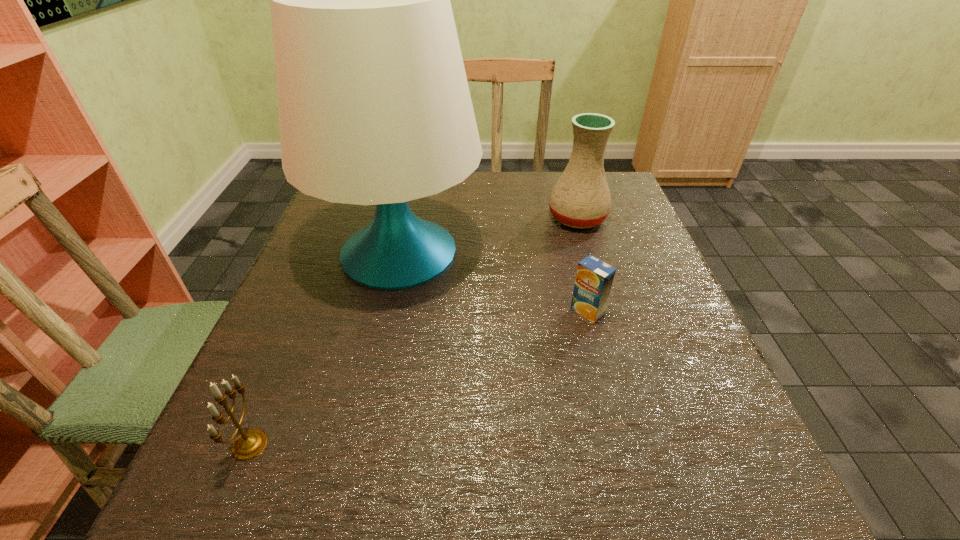
At what (x,y) coordinates should I click in order to perform the action: click on vacant point that satisfies the following two spatial constraints: 1. on the front-facing side of the table lamp; 2. on the right side of the orange_juice. Please return your answer as a coordinate pair (x, y). The width and height of the screenshot is (960, 540). Looking at the image, I should click on coord(386,311).